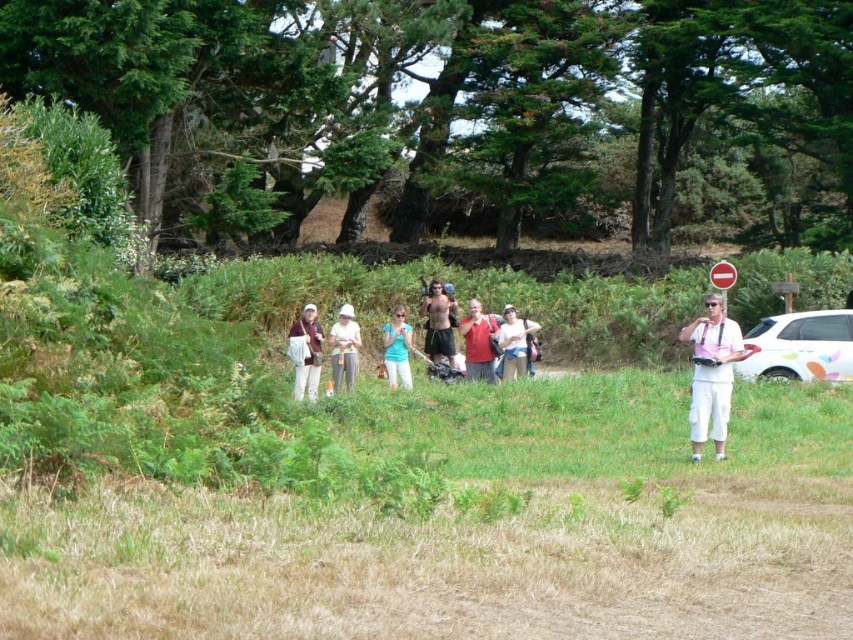
Question: Does white cotton pants at center appear on the right side of matte blue shirt at center?

Choices:
 (A) no
 (B) yes

Answer: (A)

Question: Is white cotton pants at right further to camera compared to shiny black shorts at center?

Choices:
 (A) yes
 (B) no

Answer: (B)

Question: Among these points, which one is nearest to the camera?

Choices:
 (A) (718, 403)
 (B) (303, 314)
 (C) (395, 332)
 (D) (488, 326)

Answer: (A)

Question: Considering the relative positions of white cotton pants at right and matte blue shirt at center in the image provided, where is white cotton pants at right located with respect to matte blue shirt at center?

Choices:
 (A) above
 (B) below

Answer: (B)

Question: Which object is closer to the camera taking this photo?

Choices:
 (A) white cotton pants at center
 (B) white cotton hat at center
 (C) matte blue shirt at center

Answer: (A)

Question: Among these objects, which one is nearest to the camera?

Choices:
 (A) matte red shirt at center
 (B) white cotton hat at center
 (C) white glossy car at right

Answer: (B)